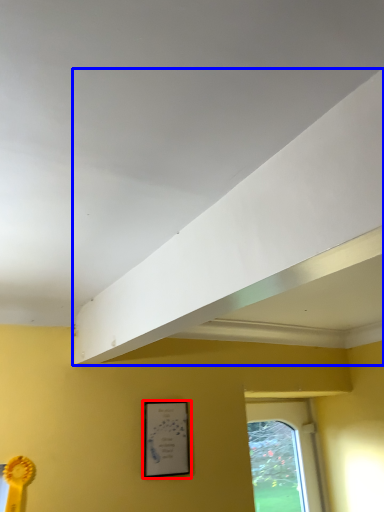
Question: Which point is closer to the camera, picture frame (highlighted by a red box) or exhaust hood (highlighted by a blue box)?

Choices:
 (A) picture frame
 (B) exhaust hood

Answer: (B)